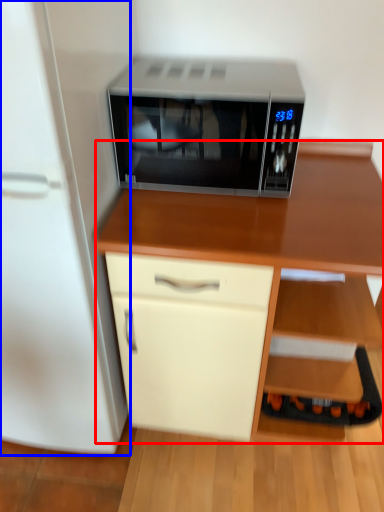
Question: Which of the following is the closest to the observer, desk (highlighted by a red box) or refrigerator (highlighted by a blue box)?

Choices:
 (A) desk
 (B) refrigerator

Answer: (B)